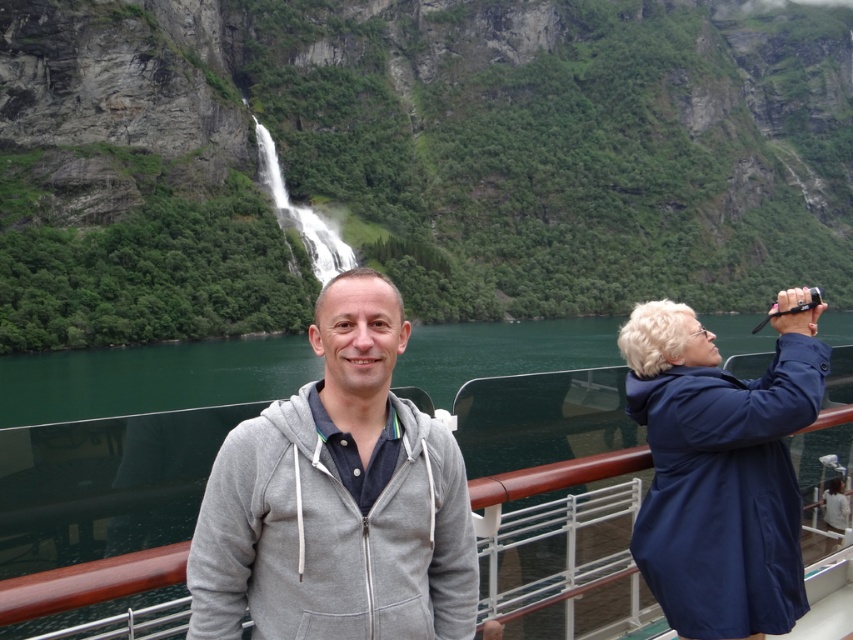
Which is more to the right, gray fabric boat at center or green water at center?

green water at center is more to the right.

Is gray fabric boat at center below green water at center?

Yes, gray fabric boat at center is below green water at center.

Between point (521, 369) and point (222, 388), which one is positioned behind?

Positioned behind is point (521, 369).

At what (x,y) coordinates should I click in order to perform the action: click on gray fabric boat at center. Please return your answer as a coordinate pair (x, y). The height and width of the screenshot is (640, 853). Looking at the image, I should click on (149, 378).

Is gray zip-up hoodie at center positioned behind gray fabric boat at center?

Yes, gray zip-up hoodie at center is behind gray fabric boat at center.

Who is lower down, gray zip-up hoodie at center or gray fabric boat at center?

Positioned lower is gray fabric boat at center.

Is point (312, 499) in front of point (416, 337)?

Yes, point (312, 499) is in front of point (416, 337).

I want to click on gray zip-up hoodie at center, so click(x=338, y=499).

Who is positioned more to the left, gray zip-up hoodie at center or green water at center?

Positioned to the left is gray zip-up hoodie at center.

Does point (395, 346) lie behind point (602, 321)?

No, (395, 346) is closer to viewer.

Between point (404, 483) and point (146, 346), which one is positioned in front?

Point (404, 483) is in front.

This screenshot has height=640, width=853. Find the location of `gray zip-up hoodie at center`. gray zip-up hoodie at center is located at coordinates (338, 499).